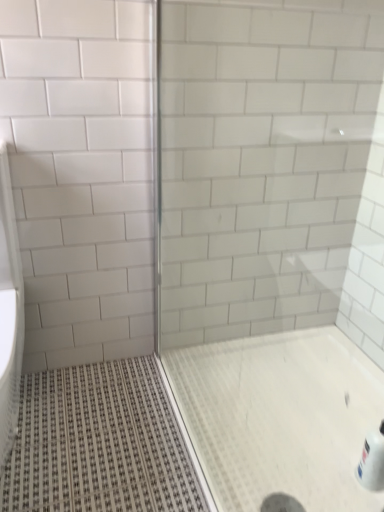
Question: From a real-world perspective, is transparent glass screen door at center physically above white glossy bottle at lower right?

Choices:
 (A) yes
 (B) no

Answer: (A)

Question: Is transparent glass screen door at center oriented away from white glossy bottle at lower right?

Choices:
 (A) no
 (B) yes

Answer: (A)

Question: From a real-world perspective, is transparent glass screen door at center under white glossy bottle at lower right?

Choices:
 (A) no
 (B) yes

Answer: (A)

Question: Is transparent glass screen door at center placed right next to white glossy bottle at lower right?

Choices:
 (A) no
 (B) yes

Answer: (A)

Question: Does transparent glass screen door at center have a larger size compared to white glossy bottle at lower right?

Choices:
 (A) no
 (B) yes

Answer: (B)

Question: Is transparent glass screen door at center oriented towards white glossy bottle at lower right?

Choices:
 (A) no
 (B) yes

Answer: (A)

Question: Is white glossy bottle at lower right not inside transparent glass screen door at center?

Choices:
 (A) yes
 (B) no

Answer: (A)

Question: From the image's perspective, is white glossy bottle at lower right located above transparent glass screen door at center?

Choices:
 (A) yes
 (B) no

Answer: (B)

Question: Does white glossy bottle at lower right have a lesser height compared to transparent glass screen door at center?

Choices:
 (A) no
 (B) yes

Answer: (B)

Question: Is white glossy bottle at lower right turned away from transparent glass screen door at center?

Choices:
 (A) no
 (B) yes

Answer: (A)

Question: Can you confirm if white glossy bottle at lower right is taller than transparent glass screen door at center?

Choices:
 (A) no
 (B) yes

Answer: (A)

Question: From the image's perspective, is white glossy bottle at lower right beneath transparent glass screen door at center?

Choices:
 (A) no
 (B) yes

Answer: (B)

Question: From a real-world perspective, relative to white glossy bottle at lower right, is transparent glass screen door at center vertically above or below?

Choices:
 (A) above
 (B) below

Answer: (A)